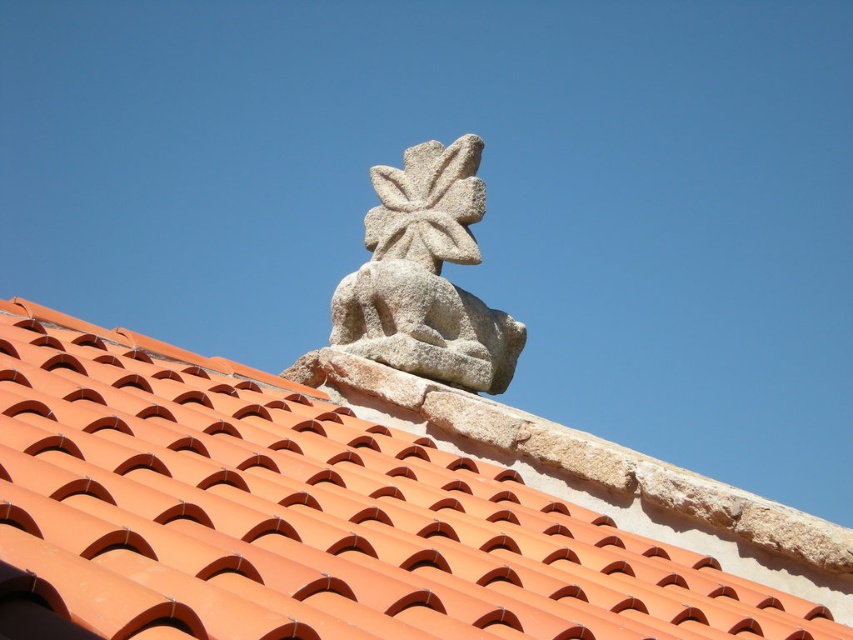
You are a contractor assessing the roof. You see the orange clay tiles at upper center and the granite statue at upper center. Which object is wider?

The orange clay tiles at upper center are wider than the granite statue at upper center because the tiles have a greater width according to the description.

You are a delivery drone that needs to land on the roof. The landing area must be clear of any obstacles. Given the orange clay tiles at upper center and the granite statue at upper center, can you safely land between them?

The orange clay tiles at upper center and the granite statue at upper center are 42.31 feet apart from each other. Since the distance between them is sufficient for a drone to land safely without obstacles, you can land between them.

You are a painter standing on a ladder to paint the roof. You need to reach both the orange clay tiles at upper center and the granite statue at upper center. Which object will require you to extend your ladder higher?

The granite statue at upper center requires extending the ladder higher because it has a greater height than the orange clay tiles at upper center.